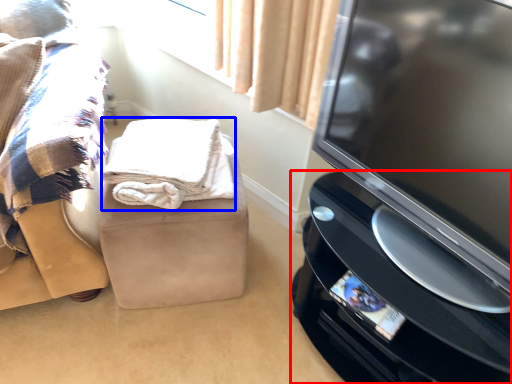
Question: Which object appears farthest to the camera in this image, home appliance (highlighted by a red box) or blanket (highlighted by a blue box)?

Choices:
 (A) home appliance
 (B) blanket

Answer: (B)